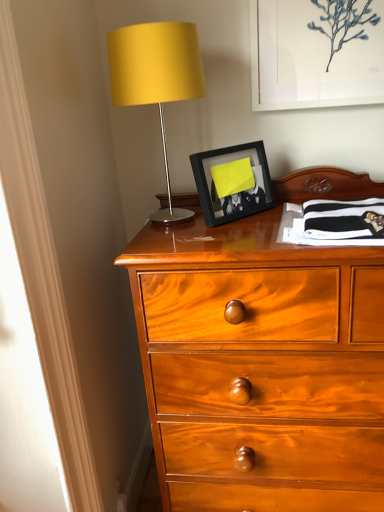
What is the approximate width of matte yellow fabric at upper left?

matte yellow fabric at upper left is 11.36 inches wide.

Measure the distance between white matte picture frame at upper center, which is the second picture frame from left to right, and camera.

white matte picture frame at upper center, which is the second picture frame from left to right, is 3.44 feet from camera.

Locate an element on the screen. Image resolution: width=384 pixels, height=512 pixels. black matte picture frame at center, which is counted as the 2th picture frame, starting from the right is located at coordinates (232, 182).

Which point is more forward, (x=247, y=209) or (x=341, y=61)?

The point (x=247, y=209) is in front.

Between black matte picture frame at center, positioned as the 1th picture frame in bottom-to-top order, and white matte picture frame at upper center, which is the second picture frame from left to right, which one appears on the left side from the viewer's perspective?

Positioned to the left is black matte picture frame at center, positioned as the 1th picture frame in bottom-to-top order.

Considering the relative sizes of black matte picture frame at center, positioned as the 1th picture frame in bottom-to-top order, and white matte picture frame at upper center, arranged as the 2th picture frame when ordered from the bottom, in the image provided, is black matte picture frame at center, positioned as the 1th picture frame in bottom-to-top order, bigger than white matte picture frame at upper center, arranged as the 2th picture frame when ordered from the bottom,?

Incorrect, black matte picture frame at center, positioned as the 1th picture frame in bottom-to-top order, is not larger than white matte picture frame at upper center, arranged as the 2th picture frame when ordered from the bottom.

What's the angular difference between black matte picture frame at center, which is the 1th picture frame in left-to-right order, and white matte picture frame at upper center, acting as the 1th picture frame starting from the right,'s facing directions?

They differ by 44 degrees in their facing directions.

Is white matte picture frame at upper center, which is the second picture frame from left to right, looking in the opposite direction of black matte picture frame at center, which is counted as the 2th picture frame, starting from the right?

No.

From the image's perspective, between white matte picture frame at upper center, the first picture frame viewed from the top, and black matte picture frame at center, which is counted as the 2th picture frame, starting from the right, which one is located above?

white matte picture frame at upper center, the first picture frame viewed from the top, is shown above in the image.

I want to click on picture frame lying on the left of white matte picture frame at upper center, arranged as the 2th picture frame when ordered from the bottom, so click(232, 182).

Would you say white matte picture frame at upper center, arranged as the 2th picture frame when ordered from the bottom, is inside or outside matte yellow fabric at upper left?

white matte picture frame at upper center, arranged as the 2th picture frame when ordered from the bottom, is not inside matte yellow fabric at upper left, it's outside.

From the picture: Can you confirm if white matte picture frame at upper center, the first picture frame viewed from the top, is thinner than matte yellow fabric at upper left?

Yes, white matte picture frame at upper center, the first picture frame viewed from the top, is thinner than matte yellow fabric at upper left.

From the image's perspective, is white matte picture frame at upper center, which is the second picture frame from left to right, above or below matte yellow fabric at upper left?

Clearly, from the image's perspective, white matte picture frame at upper center, which is the second picture frame from left to right, is above matte yellow fabric at upper left.

From a real-world perspective, does white matte picture frame at upper center, arranged as the 2th picture frame when ordered from the bottom, stand above matte yellow fabric at upper left?

Indeed, from a real-world perspective, white matte picture frame at upper center, arranged as the 2th picture frame when ordered from the bottom, stands above matte yellow fabric at upper left.

Considering the relative sizes of matte yellow fabric at upper left and white matte picture frame at upper center, which is the second picture frame from left to right, in the image provided, is matte yellow fabric at upper left wider than white matte picture frame at upper center, which is the second picture frame from left to right,?

Indeed, matte yellow fabric at upper left has a greater width compared to white matte picture frame at upper center, which is the second picture frame from left to right.

From the picture: From the image's perspective, does matte yellow fabric at upper left appear higher than white matte picture frame at upper center, arranged as the 2th picture frame when ordered from the bottom?

No, from the image's perspective, matte yellow fabric at upper left is not above white matte picture frame at upper center, arranged as the 2th picture frame when ordered from the bottom.

Can you confirm if matte yellow fabric at upper left is positioned to the left of white matte picture frame at upper center, which is the second picture frame from left to right?

Indeed, matte yellow fabric at upper left is positioned on the left side of white matte picture frame at upper center, which is the second picture frame from left to right.

Is matte yellow fabric at upper left directly adjacent to white matte picture frame at upper center, which is the second picture frame from left to right?

There is a gap between matte yellow fabric at upper left and white matte picture frame at upper center, which is the second picture frame from left to right.

In the scene shown: What's the angular difference between black matte picture frame at center, which is counted as the 2th picture frame, starting from the right, and matte yellow fabric at upper left's facing directions?

black matte picture frame at center, which is counted as the 2th picture frame, starting from the right, and matte yellow fabric at upper left are facing 43.2 degrees away from each other.

From a real-world perspective, is black matte picture frame at center, which is the 2th picture frame in top-to-bottom order, positioned above or below matte yellow fabric at upper left?

From a real-world perspective, black matte picture frame at center, which is the 2th picture frame in top-to-bottom order, is physically below matte yellow fabric at upper left.

Is black matte picture frame at center, which is counted as the 2th picture frame, starting from the right, not near matte yellow fabric at upper left?

They are positioned close to each other.

Which picture frame is the 1st one when counting from the back of the matte yellow fabric at upper left? Please provide its 2D coordinates.

[(232, 182)]

Is matte yellow fabric at upper left oriented away from black matte picture frame at center, positioned as the 1th picture frame in bottom-to-top order?

That's not correct — matte yellow fabric at upper left is not looking away from black matte picture frame at center, positioned as the 1th picture frame in bottom-to-top order.

Looking at this image, who is taller, matte yellow fabric at upper left or black matte picture frame at center, which is the 2th picture frame in top-to-bottom order?

matte yellow fabric at upper left is taller.

From a real-world perspective, is matte yellow fabric at upper left located beneath black matte picture frame at center, which is the 2th picture frame in top-to-bottom order?

No, from a real-world perspective, matte yellow fabric at upper left is not beneath black matte picture frame at center, which is the 2th picture frame in top-to-bottom order.

In the scene shown: Which is closer, (x=200, y=62) or (x=240, y=208)?

Clearly, point (x=200, y=62) is more distant from the camera than point (x=240, y=208).

The image size is (384, 512). In order to click on picture frame in front of the white matte picture frame at upper center, which is the second picture frame from left to right in this screenshot , I will do `click(232, 182)`.

This screenshot has height=512, width=384. In order to click on picture frame that is on the left side of white matte picture frame at upper center, acting as the 1th picture frame starting from the right in this screenshot , I will do `click(232, 182)`.

Looking at the image, which one is located closer to matte yellow fabric at upper left, black matte picture frame at center, positioned as the 1th picture frame in bottom-to-top order, or white matte picture frame at upper center, arranged as the 2th picture frame when ordered from the bottom?

black matte picture frame at center, positioned as the 1th picture frame in bottom-to-top order, is closer to matte yellow fabric at upper left.

Looking at the image, which one is located closer to black matte picture frame at center, positioned as the 1th picture frame in bottom-to-top order, matte yellow fabric at upper left or white matte picture frame at upper center, which is the second picture frame from left to right?

Among the two, matte yellow fabric at upper left is located nearer to black matte picture frame at center, positioned as the 1th picture frame in bottom-to-top order.

Based on their spatial positions, is black matte picture frame at center, which is the 1th picture frame in left-to-right order, or matte yellow fabric at upper left closer to white matte picture frame at upper center, arranged as the 2th picture frame when ordered from the bottom?

Based on the image, black matte picture frame at center, which is the 1th picture frame in left-to-right order, appears to be nearer to white matte picture frame at upper center, arranged as the 2th picture frame when ordered from the bottom.

Estimate the real-world distances between objects in this image. Which object is further from white matte picture frame at upper center, which is the second picture frame from left to right, matte yellow fabric at upper left or black matte picture frame at center, which is counted as the 2th picture frame, starting from the right?

Among the two, matte yellow fabric at upper left is located further to white matte picture frame at upper center, which is the second picture frame from left to right.

Based on the photo, looking at the image, which one is located closer to matte yellow fabric at upper left, white matte picture frame at upper center, acting as the 1th picture frame starting from the right, or black matte picture frame at center, positioned as the 1th picture frame in bottom-to-top order?

black matte picture frame at center, positioned as the 1th picture frame in bottom-to-top order, lies closer to matte yellow fabric at upper left than the other object.

When comparing their distances from black matte picture frame at center, which is the 1th picture frame in left-to-right order, does white matte picture frame at upper center, which is the second picture frame from left to right, or matte yellow fabric at upper left seem further?

white matte picture frame at upper center, which is the second picture frame from left to right, is further to black matte picture frame at center, which is the 1th picture frame in left-to-right order.

This screenshot has height=512, width=384. What are the coordinates of `picture frame situated between matte yellow fabric at upper left and white matte picture frame at upper center, which is the second picture frame from left to right, from left to right` in the screenshot? It's located at (232, 182).